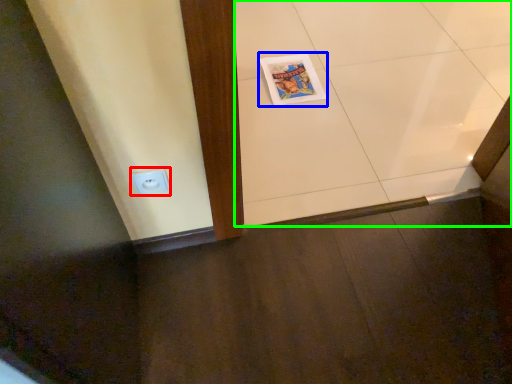
Question: Which object is positioned farthest from electric outlet (highlighted by a red box)? Select from comic book (highlighted by a blue box) and ceramic tile (highlighted by a green box).

Choices:
 (A) comic book
 (B) ceramic tile

Answer: (B)